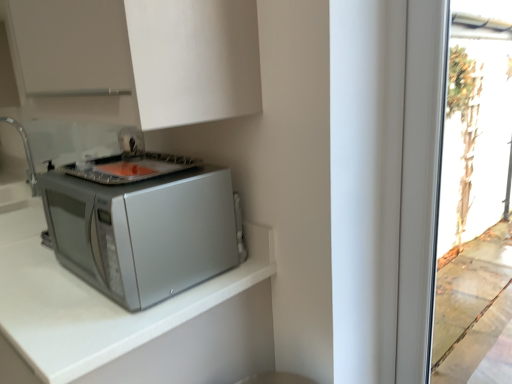
Question: Is brushed metal sink at left taller or shorter than satin silver microwave at lower left?

Choices:
 (A) short
 (B) tall

Answer: (B)

Question: Based on their positions, is brushed metal sink at left located to the left or right of satin silver microwave at lower left?

Choices:
 (A) left
 (B) right

Answer: (A)

Question: Which object is the farthest from the satin silver microwave at lower left?

Choices:
 (A) silver matte microwave at lower left
 (B) white matte cabinet at upper center
 (C) brushed metal sink at left

Answer: (C)

Question: Which object is positioned closest to the white matte cabinet at upper center?

Choices:
 (A) brushed metal sink at left
 (B) satin silver microwave at lower left
 (C) silver matte microwave at lower left

Answer: (B)